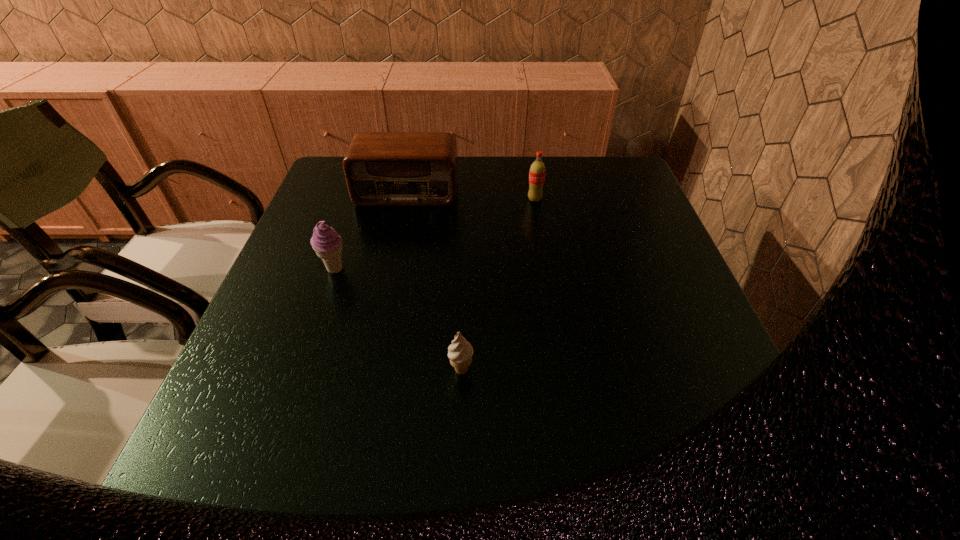
This screenshot has width=960, height=540. What are the coordinates of `vacant region between the soda and the nearer icecream` in the screenshot? It's located at (498, 285).

Locate an element on the screen. The image size is (960, 540). blank region between the farther icecream and the third object from left to right is located at coordinates (398, 320).

Where is `blank region between the radio receiver and the soda`? The image size is (960, 540). blank region between the radio receiver and the soda is located at coordinates (470, 196).

Where is `free spot between the radio receiver and the farther icecream`? This screenshot has width=960, height=540. free spot between the radio receiver and the farther icecream is located at coordinates (371, 231).

Where is `free spot between the radio receiver and the second object from right to left`? Image resolution: width=960 pixels, height=540 pixels. free spot between the radio receiver and the second object from right to left is located at coordinates (434, 281).

You are a GUI agent. You are given a task and a screenshot of the screen. Output one action in this format:
    pyautogui.click(x=<x>, y=<y>)
    Task: Click on the free point between the taller icecream and the radio receiver
    
    Given the screenshot: What is the action you would take?
    pyautogui.click(x=371, y=231)

Where is `unoccupied area between the second object from right to left and the rightmost object`? Image resolution: width=960 pixels, height=540 pixels. unoccupied area between the second object from right to left and the rightmost object is located at coordinates (498, 285).

Find the location of `vacant area that lies between the radio receiver and the shorter icecream`. vacant area that lies between the radio receiver and the shorter icecream is located at coordinates (434, 281).

Where is `vacant space in between the soda and the nearer icecream`? This screenshot has height=540, width=960. vacant space in between the soda and the nearer icecream is located at coordinates (498, 285).

I want to click on free space between the third object from left to right and the radio receiver, so click(434, 281).